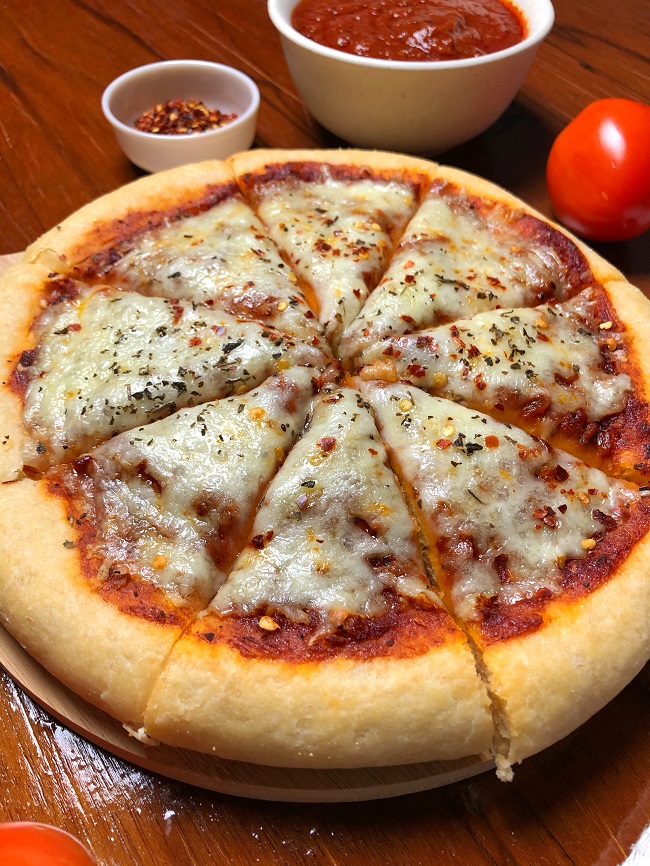
You are a GUI agent. You are given a task and a screenshot of the screen. Output one action in this format:
    pyautogui.click(x=<x>, y=<y>)
    Task: Click on the table
    The width and height of the screenshot is (650, 866).
    Given the screenshot: What is the action you would take?
    pyautogui.click(x=57, y=124), pyautogui.click(x=47, y=469)